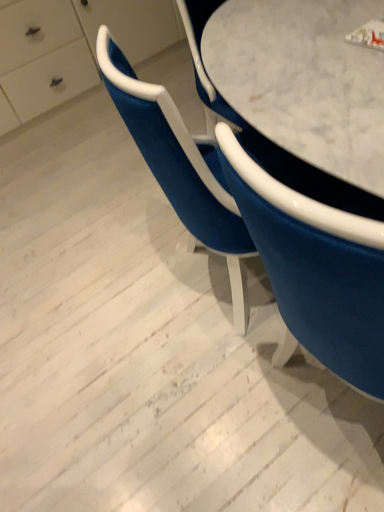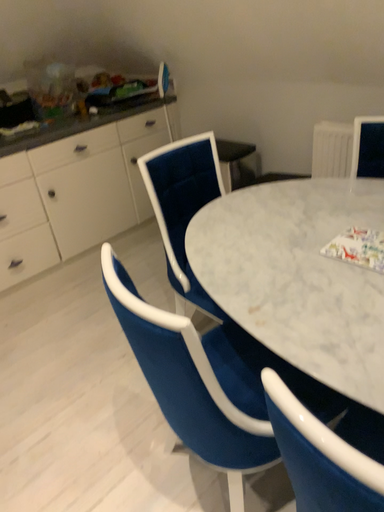
Question: How did the camera likely rotate when shooting the video?

Choices:
 (A) rotated upward
 (B) rotated downward

Answer: (A)